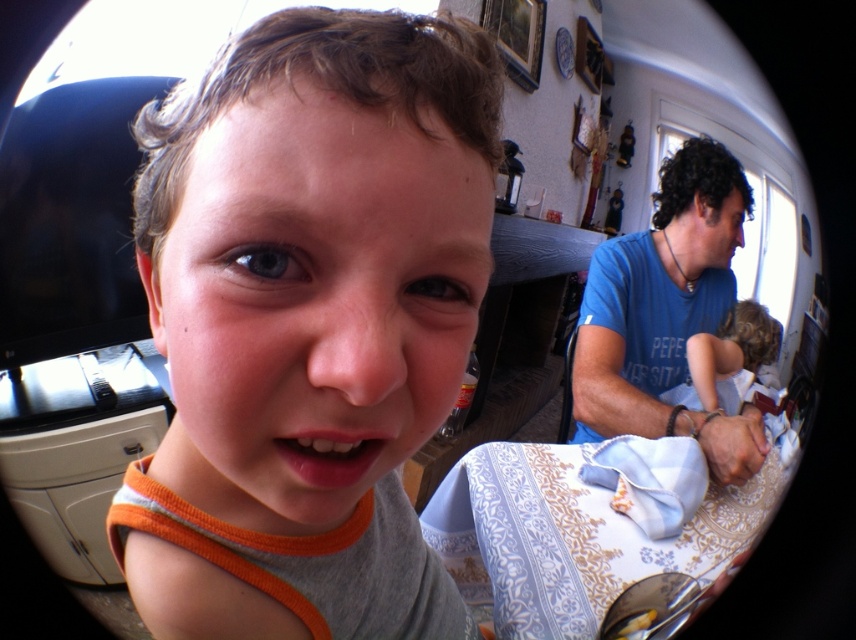
Can you confirm if orange fabric shirt at center is positioned below blonde hair at right?

Yes.

Who is taller, orange fabric shirt at center or blonde hair at right?

Standing taller between the two is orange fabric shirt at center.

The width and height of the screenshot is (856, 640). Identify the location of orange fabric shirt at center. (308, 323).

Find the location of a particular element. orange fabric shirt at center is located at coordinates click(308, 323).

Between orange fabric shirt at center and blue cotton shirt at right, which one appears on the left side from the viewer's perspective?

From the viewer's perspective, orange fabric shirt at center appears more on the left side.

Can you confirm if orange fabric shirt at center is positioned below blue cotton shirt at right?

Indeed, orange fabric shirt at center is positioned under blue cotton shirt at right.

Does point (248, 291) come in front of point (724, 468)?

That is True.

At what (x,y) coordinates should I click in order to perform the action: click on orange fabric shirt at center. Please return your answer as a coordinate pair (x, y). Looking at the image, I should click on (308, 323).

Is blue cotton shirt at right above blonde hair at right?

Indeed, blue cotton shirt at right is positioned over blonde hair at right.

Between blue cotton shirt at right and blonde hair at right, which one has less height?

With less height is blonde hair at right.

Locate an element on the screen. The width and height of the screenshot is (856, 640). blue cotton shirt at right is located at coordinates (666, 314).